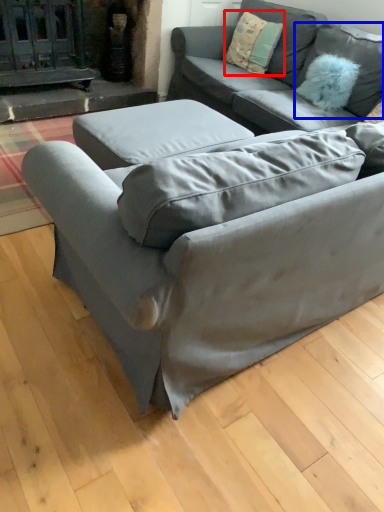
Question: Among these objects, which one is farthest to the camera, pillow (highlighted by a red box) or pillow (highlighted by a blue box)?

Choices:
 (A) pillow
 (B) pillow

Answer: (A)